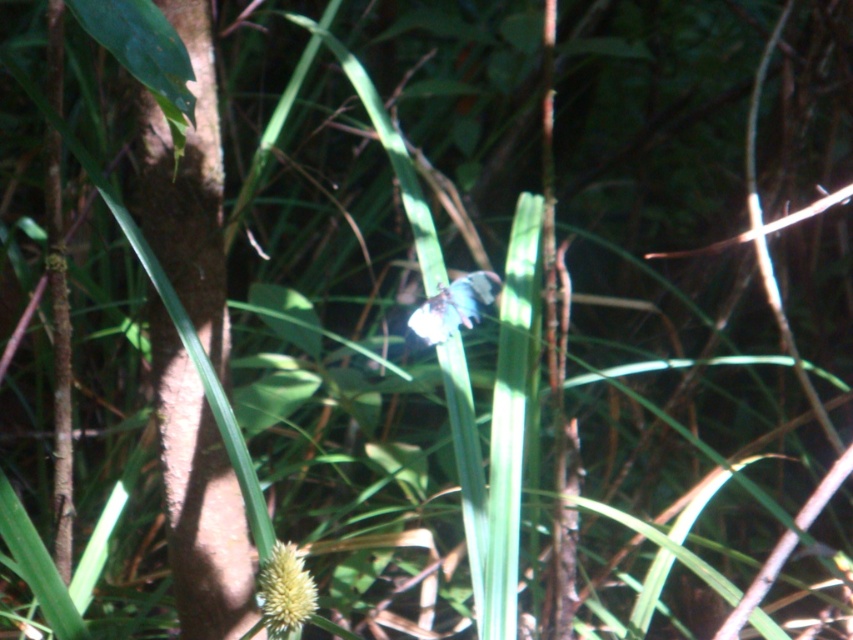
You are a botanist studying flowers in a forest. You have two flowers in front of you, a white fuzzy flower at center and a white matte flower at center. You need to place them in a display case that is 18 inches wide. Can both flowers fit side by side without overlapping?

The white fuzzy flower at center is 18.36 inches away from the white matte flower at center, which means the total distance between them is greater than the 18 inch width of the display case. Therefore, both flowers cannot fit side by side without overlapping in the display case.

You are an entomologist observing two flowers in a forest. You see a white fuzzy flower at center and a white matte flower at center. Which flower is nearer to you?

The white fuzzy flower at center is closer to the viewer than the white matte flower at center.

You are a botanist examining two flowers in the center of a dense jungle scene. The scene has tall, slender leaves and a butterfly. Which flower is positioned lower between the white fuzzy flower at center and the white matte flower at center?

The white fuzzy flower at center is positioned lower than the white matte flower at center.